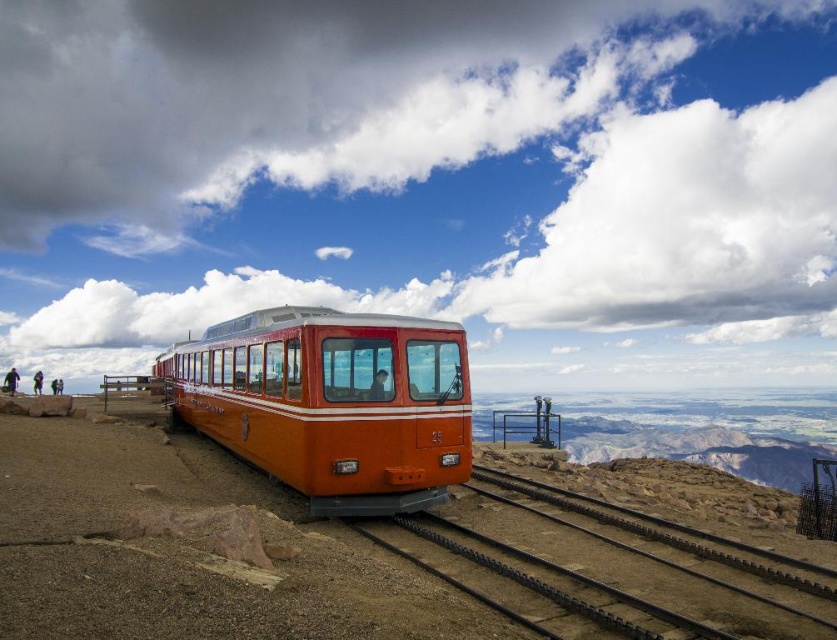
You are standing at the front of the tram and looking out. There are two points marked on the rocky terrain ahead. Which point is closer to you, point [337,358] or point [491,513]?

Point [337,358] is closer to you than point [491,513].

You are a passenger on the orange matte train at center. You want to know where you are located in the tram. Can you tell me the coordinates of your current position?

The orange matte train at center is located at coordinates point (332, 403).

You are standing at the point marked as point (332, 403) in the image. What object is located exactly at that point?

The point (332, 403) indicates orange matte train at center.